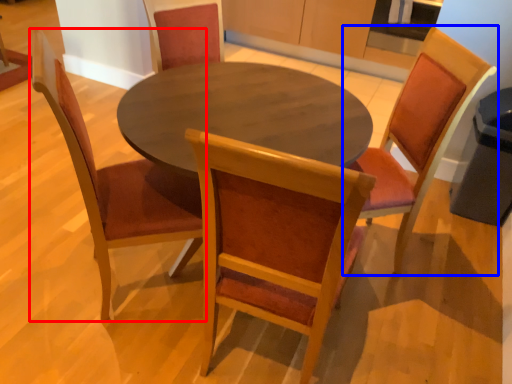
Question: Among these objects, which one is farthest to the camera, chair (highlighted by a red box) or chair (highlighted by a blue box)?

Choices:
 (A) chair
 (B) chair

Answer: (B)